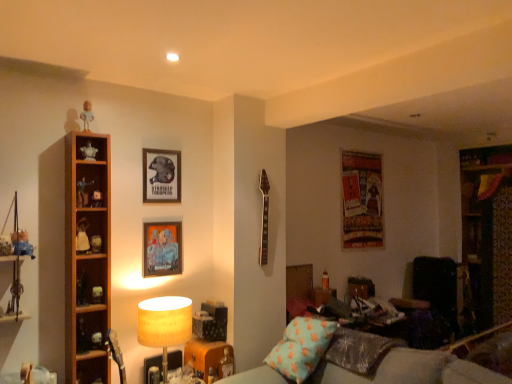
Question: Considering the positions of white matte figurine at upper left, arranged as the sixth toy when viewed from the left, and white matte figurine at upper left, which is counted as the tenth toy, starting from the bottom, in the image, is white matte figurine at upper left, arranged as the sixth toy when viewed from the left, taller or shorter than white matte figurine at upper left, which is counted as the tenth toy, starting from the bottom,?

Choices:
 (A) short
 (B) tall

Answer: (B)

Question: From the image's perspective, is white matte figurine at upper left, positioned as the 11th toy in bottom-to-top order, located above or below white matte figurine at upper left, the seventh toy viewed from the left?

Choices:
 (A) below
 (B) above

Answer: (B)

Question: Based on their relative distances, which object is nearer to the white glossy figurine at left, which is counted as the 4th toy, starting from the bottom?

Choices:
 (A) textured fabric poster at upper right, which ranks as the 1th picture frame in right-to-left order
 (B) matte white figurine at center, which is the eleventh toy from left to right
 (C) cotton/polyester pillow at lower right
 (D) white matte doll at left, the 7th toy ordered from the bottom
 (E) matte white figurine at left, which is counted as the 10th toy, starting from the right

Answer: (D)

Question: Based on their relative distances, which object is nearer to the black leather swivel chair at lower right?

Choices:
 (A) white matte doll at left, the third toy positioned from the left
 (B) matte plastic picture frame at center, positioned as the second picture frame in left-to-right order
 (C) white matte figurine at left, the second toy ordered from the bottom
 (D) matte white figurine at center, the 1th toy in the right-to-left sequence
 (E) matte black figurine at left, which is the eighth toy in right-to-left order

Answer: (D)